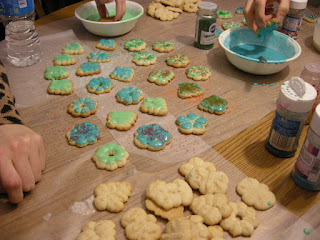
This screenshot has width=320, height=240. I want to click on plastic over table, so click(x=93, y=175), click(x=172, y=153).